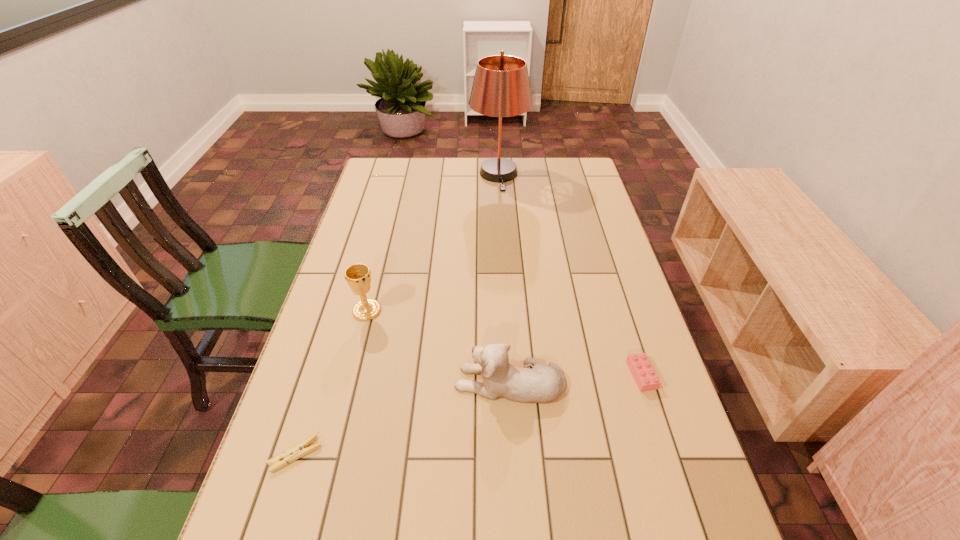
The image size is (960, 540). What are the coordinates of `free space between the shortest object and the tallest object` in the screenshot? It's located at (397, 315).

Where is `free point between the puppy and the clothespin`? free point between the puppy and the clothespin is located at coordinates (403, 418).

Locate an element on the screen. free space between the tallest object and the chalice is located at coordinates (433, 242).

This screenshot has height=540, width=960. I want to click on object that is the closest one to the Lego, so click(x=543, y=383).

You are a GUI agent. You are given a task and a screenshot of the screen. Output one action in this format:
    pyautogui.click(x=<x>, y=<y>)
    Task: Click on the object that is the nearest to the lampshade
    Image resolution: width=960 pixels, height=540 pixels.
    Given the screenshot: What is the action you would take?
    pyautogui.click(x=358, y=276)

Identify the location of vacant region that satisfies the following two spatial constraints: 1. on the front-facing side of the farthest object; 2. on the front-facing side of the puppy. (512, 382).

Locate an element on the screen. This screenshot has width=960, height=540. free space that satisfies the following two spatial constraints: 1. on the front-facing side of the lampshade; 2. on the front-facing side of the puppy is located at coordinates (512, 382).

Where is `vacant area that satisfies the following two spatial constraints: 1. on the front side of the rightmost object; 2. on the front-facing side of the puppy`? vacant area that satisfies the following two spatial constraints: 1. on the front side of the rightmost object; 2. on the front-facing side of the puppy is located at coordinates (644, 382).